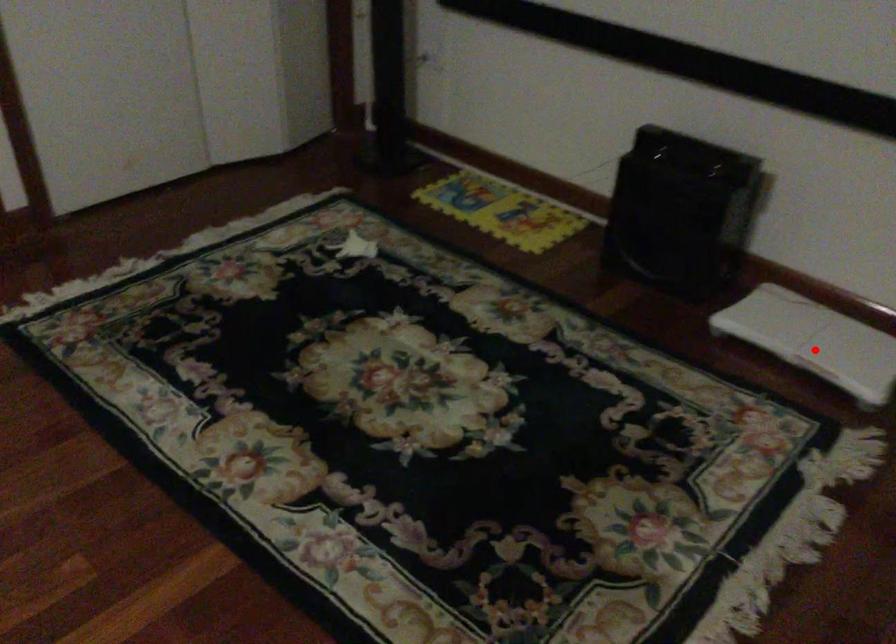
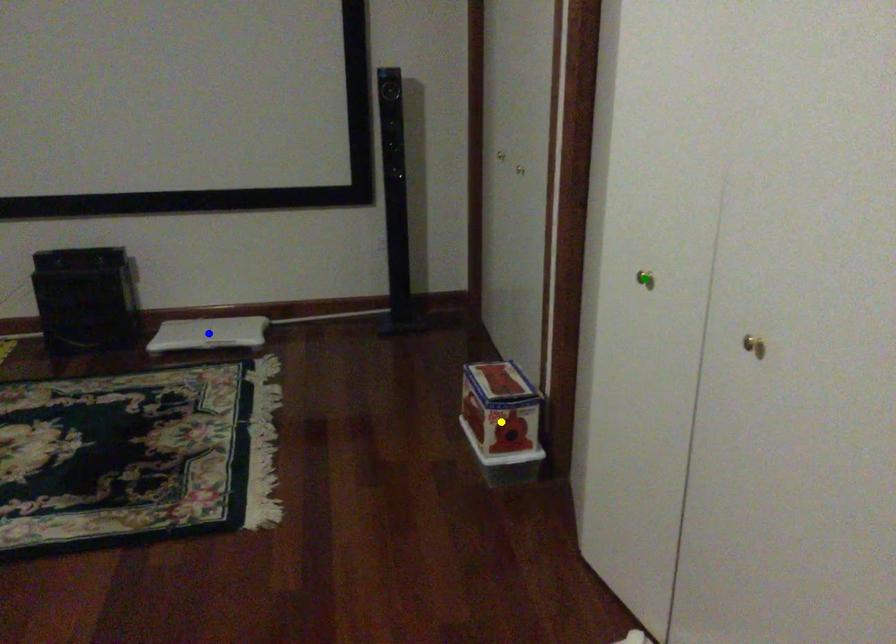
Question: I am providing you with two images of the same scene from different viewpoints. A red point is marked on the first image. You are given multiple points on the second image. Which mark in image 2 goes with the point in image 1?

Choices:
 (A) blue point
 (B) yellow point
 (C) green point

Answer: (A)